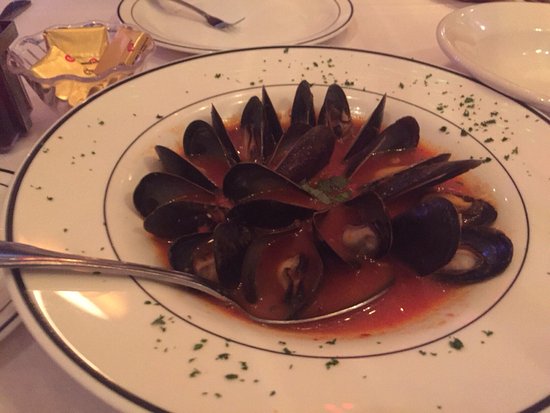
What are the coordinates of `glass container` in the screenshot? It's located at (27, 51).